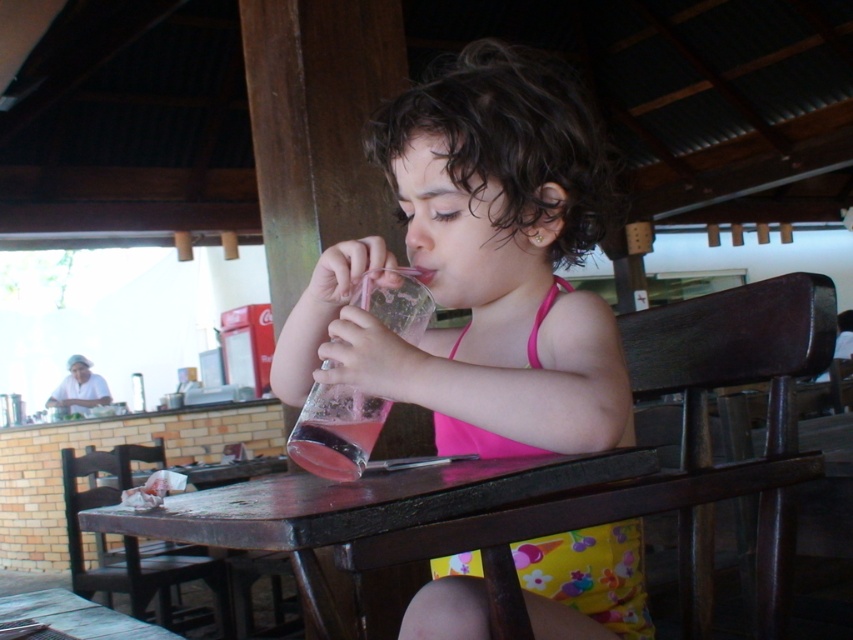
In the scene shown: You are standing at the edge of the table in the image and want to place a small decoration between the two points labeled point (122, 531) and point (73, 614). Which point should you move toward to place the decoration closer to you?

You should move toward point (122, 531) because it is closer to the viewer than point (73, 614).

You are standing at the brick wall counter in the background and want to place two items on the table. The first item should be placed at point [432,170] and the second item at point [39,596]. Which point is closer to you when viewed from your current position?

Point [432,170] is closer to the viewer than point [39,596].